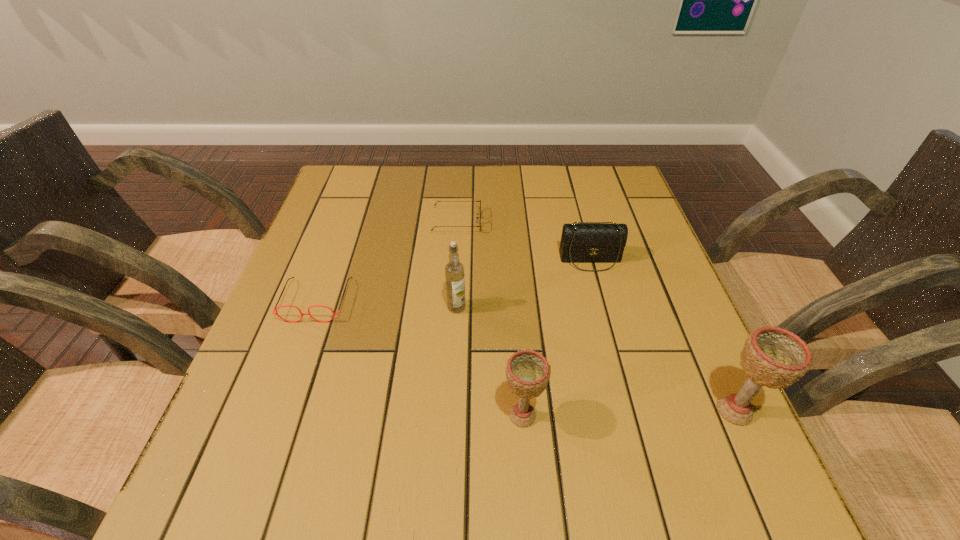
Locate an element on the screen. This screenshot has height=540, width=960. blank space that satisfies the following two spatial constraints: 1. on the front-facing side of the leftmost object; 2. on the right side of the left chalice is located at coordinates (275, 415).

This screenshot has width=960, height=540. Identify the location of blank space that satisfies the following two spatial constraints: 1. on the label of the left chalice; 2. on the left side of the vodka. (451, 415).

Find the location of a particular element. The image size is (960, 540). vacant point that satisfies the following two spatial constraints: 1. on the front-facing side of the shorter chalice; 2. on the left side of the leftmost object is located at coordinates (275, 415).

The image size is (960, 540). What are the coordinates of `free spot that satisfies the following two spatial constraints: 1. on the front-facing side of the shorter chalice; 2. on the left side of the farthest object` in the screenshot? It's located at (445, 415).